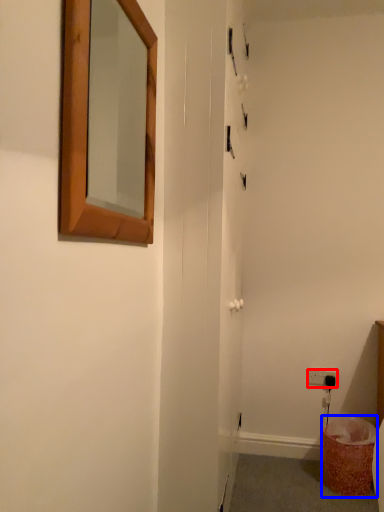
Question: Among these objects, which one is farthest to the camera, electric outlet (highlighted by a red box) or laundry basket (highlighted by a blue box)?

Choices:
 (A) electric outlet
 (B) laundry basket

Answer: (A)